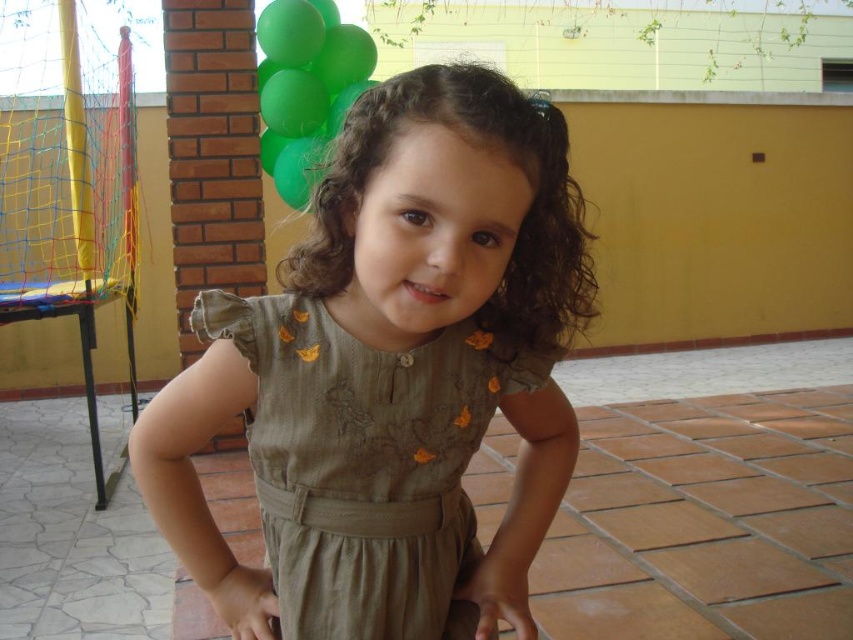
Is olive green fabric dress at center wider than green matte balloon at upper left?

Incorrect, olive green fabric dress at center's width does not surpass green matte balloon at upper left's.

Who is positioned more to the left, olive green fabric dress at center or green matte balloon at upper left?

green matte balloon at upper left

Is point (325, 436) positioned behind point (268, 52)?

No, (325, 436) is in front of (268, 52).

What are the coordinates of `olive green fabric dress at center` in the screenshot? It's located at (364, 461).

Locate an element on the screen. matte green dress at center is located at coordinates (397, 353).

Does matte green dress at center have a larger size compared to green matte balloon at upper left?

No, matte green dress at center is not bigger than green matte balloon at upper left.

Where is `matte green dress at center`? matte green dress at center is located at coordinates (397, 353).

Can you confirm if matte green dress at center is smaller than olive green fabric dress at center?

Actually, matte green dress at center might be larger than olive green fabric dress at center.

Who is more forward, (438, 417) or (212, 333)?

Point (212, 333) is more forward.

What are the coordinates of `matte green dress at center` in the screenshot? It's located at (397, 353).

Identify the location of matte green dress at center. The height and width of the screenshot is (640, 853). (397, 353).